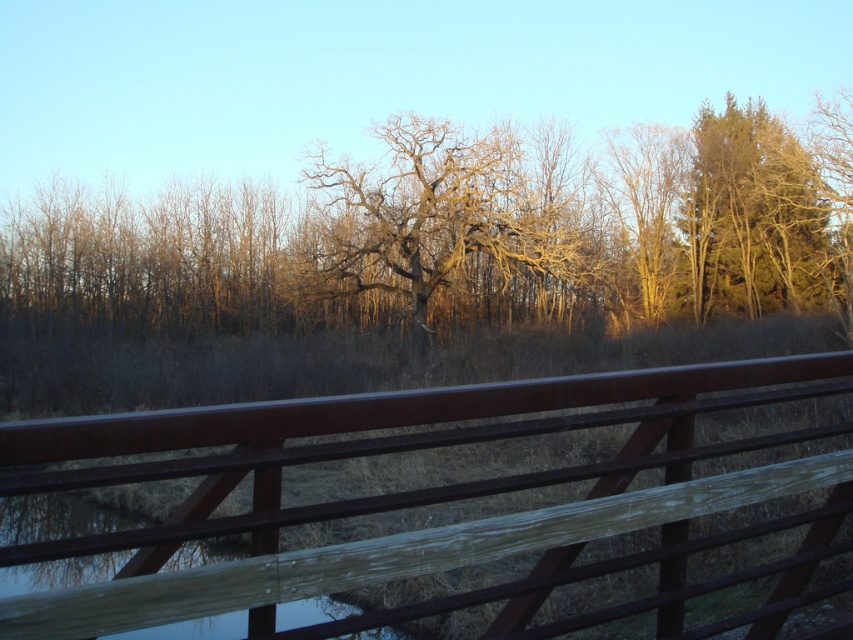
Does bare wood tree at center appear under transparent water at bridge center?

Incorrect, bare wood tree at center is not positioned below transparent water at bridge center.

Does point (381, 256) come behind point (21, 520)?

Yes, point (381, 256) is farther from viewer.

The height and width of the screenshot is (640, 853). What are the coordinates of `bare wood tree at center` in the screenshot? It's located at (450, 220).

At what (x,y) coordinates should I click in order to perform the action: click on bare wood tree at center. Please return your answer as a coordinate pair (x, y). The height and width of the screenshot is (640, 853). Looking at the image, I should click on (450, 220).

Does point (349, 544) come behind point (430, 118)?

No.

Is point (782, 433) closer to viewer compared to point (433, 177)?

Yes, point (782, 433) is in front of point (433, 177).

This screenshot has height=640, width=853. What are the coordinates of `rustic wood fence at center` in the screenshot? It's located at (422, 497).

Can you confirm if rustic wood fence at center is positioned above green textured tree at upper right?

No.

Which is in front, point (683, 452) or point (817, 230)?

Point (683, 452)

Find the location of a particular element. This screenshot has width=853, height=640. rustic wood fence at center is located at coordinates (422, 497).